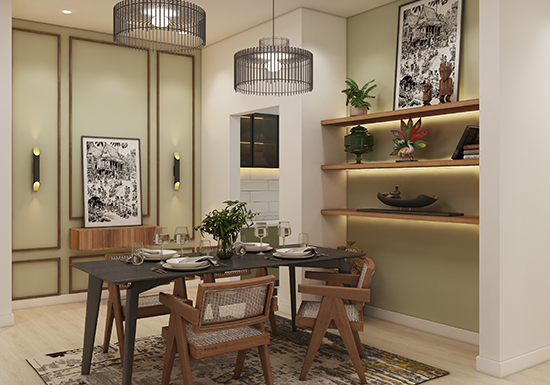
Find the location of a particular element. The height and width of the screenshot is (385, 550). hardwood floors is located at coordinates (58, 324).